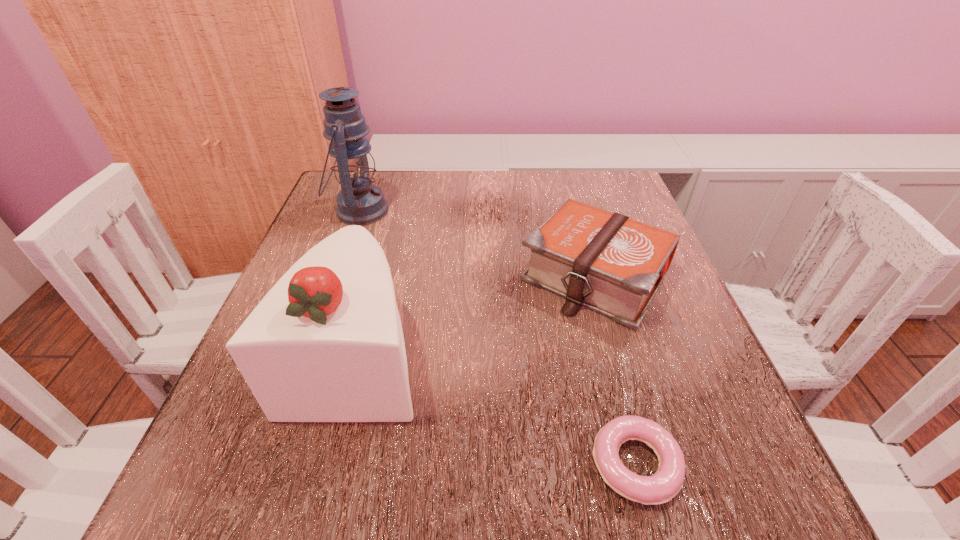
Identify the location of free spot between the second shortest object and the lantern. (477, 244).

I want to click on vacant area that lies between the nearest object and the lantern, so click(497, 338).

Identify the location of free area in between the doughnut and the second shortest object. (615, 370).

Identify the location of free spot between the second shortest object and the lantern. (477, 244).

Where is `vacant point located between the second shortest object and the second tallest object`? vacant point located between the second shortest object and the second tallest object is located at coordinates (476, 315).

The height and width of the screenshot is (540, 960). Identify the location of empty location between the Bible and the nearest object. (615, 370).

In order to click on vacant space that's between the second shortest object and the lantern in this screenshot , I will do `click(477, 244)`.

Find the location of a particular element. free spot between the third shortest object and the doughnut is located at coordinates (496, 409).

Point out which object is positioned as the nearest to the lantern. Please provide its 2D coordinates. Your answer should be formatted as a tuple, i.e. [(x, y)], where the tuple contains the x and y coordinates of a point satisfying the conditions above.

[(325, 344)]

Select which object appears as the closest to the third shortest object. Please provide its 2D coordinates. Your answer should be formatted as a tuple, i.e. [(x, y)], where the tuple contains the x and y coordinates of a point satisfying the conditions above.

[(607, 262)]